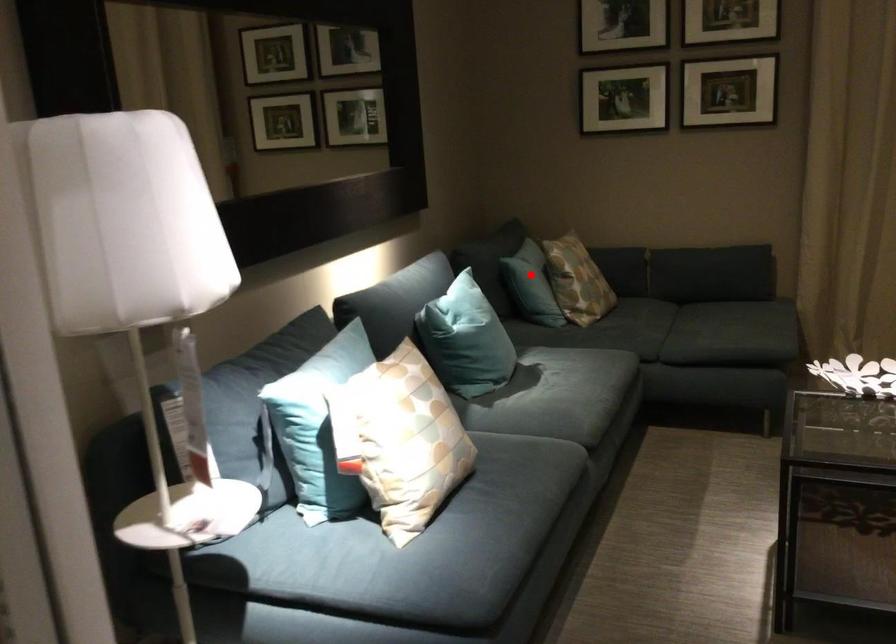
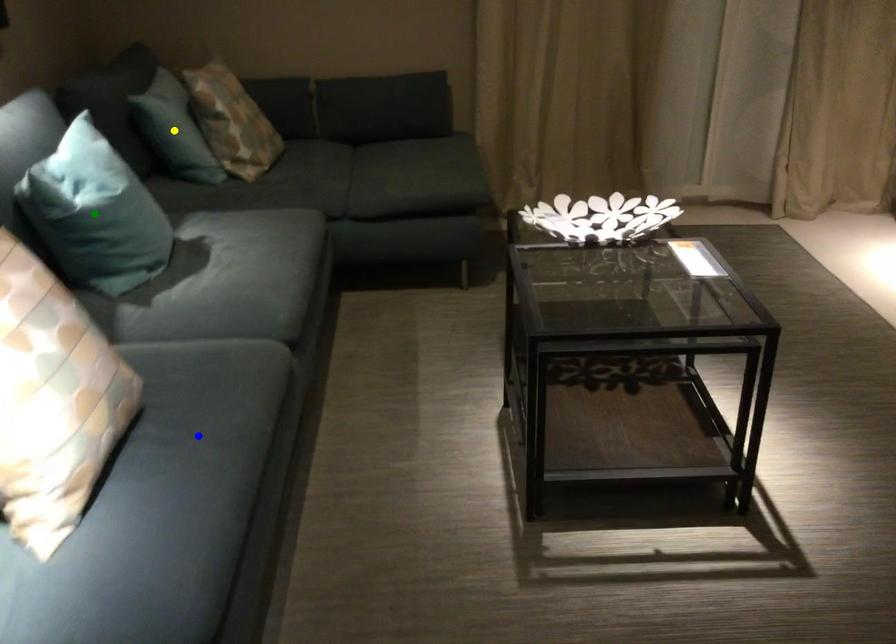
Question: I am providing you with two images of the same scene from different viewpoints. A red point is marked on the first image. You are given multiple points on the second image. Can you choose the point in image 2 that corresponds to the point in image 1?

Choices:
 (A) blue point
 (B) green point
 (C) yellow point

Answer: (C)